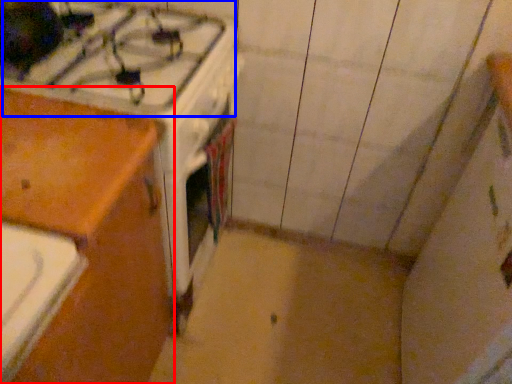
Question: Which of the following is the farthest to the observer, cabinetry (highlighted by a red box) or gas stove (highlighted by a blue box)?

Choices:
 (A) cabinetry
 (B) gas stove

Answer: (B)